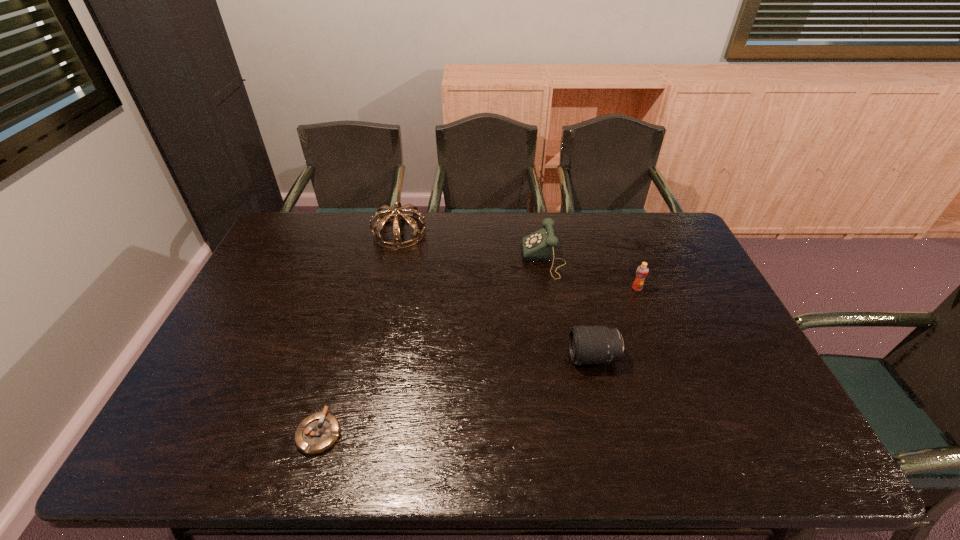
You are a GUI agent. You are given a task and a screenshot of the screen. Output one action in this format:
    pyautogui.click(x=<x>, y=<y>)
    Task: Click on the blank region between the ashtray and the second nearest object
    This screenshot has width=960, height=540.
    Given the screenshot: What is the action you would take?
    pyautogui.click(x=456, y=395)

Image resolution: width=960 pixels, height=540 pixels. What are the coordinates of `blank region between the tallest object and the second nearest object` in the screenshot? It's located at (496, 295).

Locate an element on the screen. This screenshot has width=960, height=540. empty space between the ashtray and the third farthest object is located at coordinates 478,361.

Locate an element on the screen. The image size is (960, 540). empty space that is in between the nearest object and the third nearest object is located at coordinates (478, 361).

Locate an element on the screen. Image resolution: width=960 pixels, height=540 pixels. object that stands as the third closest to the orange juice is located at coordinates (413, 219).

In order to click on object that is the fourth closest to the third farthest object in this screenshot , I will do `click(317, 433)`.

Where is `free location that satisfies the following two spatial constraints: 1. on the dial of the telephone; 2. on the left side of the rightmost object`? The height and width of the screenshot is (540, 960). free location that satisfies the following two spatial constraints: 1. on the dial of the telephone; 2. on the left side of the rightmost object is located at coordinates (549, 288).

Identify the location of free location that satisfies the following two spatial constraints: 1. on the front side of the third nearest object; 2. on the left side of the tallest object. The height and width of the screenshot is (540, 960). (387, 288).

Locate an element on the screen. free region that satisfies the following two spatial constraints: 1. on the dial of the rightmost object; 2. on the right side of the telephone is located at coordinates (549, 288).